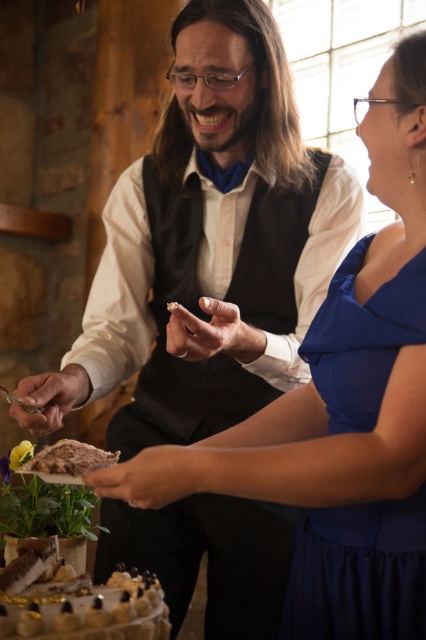
You are a guest at the celebration and want to choose the larger cake for dessert. Which one should you pick between the chocolate frosted cake at lower left and the brown crumbly cake at lower left?

The chocolate frosted cake at lower left is bigger than the brown crumbly cake at lower left, so you should pick the chocolate frosted cake at lower left.

You are a photographer at the event and need to capture a candid shot of the woman and the chocolate frosted cake at lower left. The camera you are using has a maximum focus range of 30 inches. Will you be able to focus on both subjects clearly without moving the camera?

The woman and the chocolate frosted cake at lower left are 32.04 inches apart. Since the camera can only focus within 30 inches, the distance exceeds the maximum focus range. Therefore, you cannot focus on both subjects clearly without moving the camera.

You are a photographer trying to capture a candid shot of the couple at this celebration. You notice a specific point in the scene marked at coordinates point (52, 612). Considering the distance between this point and the camera, would you need to adjust your focus settings to ensure clarity in the final photo?

The point (52, 612) is 34.15 inches away from the camera. Since this distance is within typical focus range for handheld photography, no adjustment is needed for clarity.